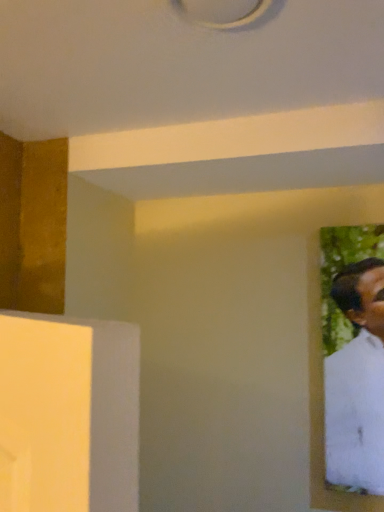
Find the location of a particular element. The width and height of the screenshot is (384, 512). white matte painting at right is located at coordinates (357, 382).

The image size is (384, 512). What do you see at coordinates (357, 382) in the screenshot? I see `white matte painting at right` at bounding box center [357, 382].

Measure the distance between white matte painting at right and camera.

A distance of 1.19 meters exists between white matte painting at right and camera.

At what (x,y) coordinates should I click in order to perform the action: click on white matte painting at right. Please return your answer as a coordinate pair (x, y). Looking at the image, I should click on (357, 382).